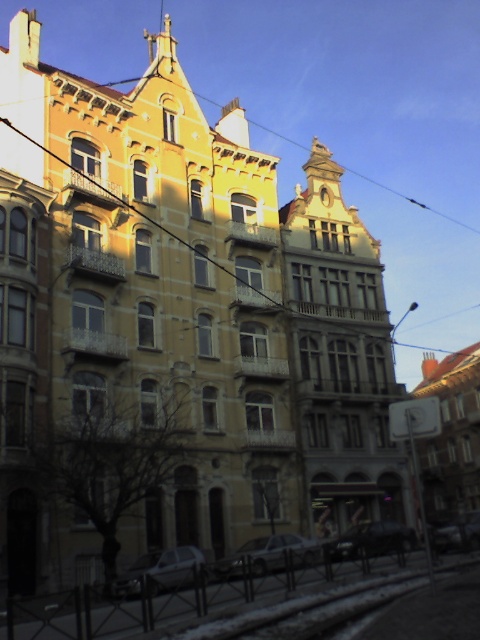
Which is more to the right, shiny black car at lower center or yellow matte clock at upper center?

From the viewer's perspective, shiny black car at lower center appears more on the right side.

Is point (349, 552) positioned behind point (326, 195)?

No.

This screenshot has height=640, width=480. I want to click on shiny black car at lower center, so click(x=372, y=540).

Which is above, silver metallic car at center or yellow matte clock at upper center?

yellow matte clock at upper center is above.

Measure the distance from silver metallic car at center to yellow matte clock at upper center.

silver metallic car at center and yellow matte clock at upper center are 132.30 feet apart from each other.

Does point (218, 564) come in front of point (326, 195)?

That is True.

I want to click on silver metallic car at center, so click(269, 554).

Which is below, silver metallic car at center or silver metallic car at lower center?

silver metallic car at lower center

At what (x,y) coordinates should I click in order to perform the action: click on silver metallic car at center. Please return your answer as a coordinate pair (x, y). This screenshot has width=480, height=640. Looking at the image, I should click on (269, 554).

Identify the location of silver metallic car at center. (269, 554).